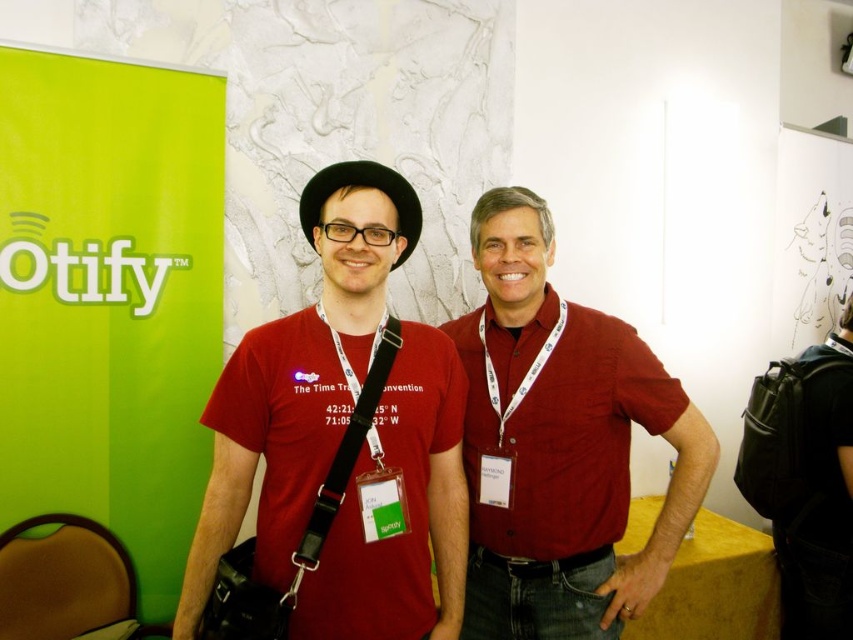
Question: Which object appears farthest from the camera in this image?

Choices:
 (A) white/thick fabric lanyard at center
 (B) matte red shirt at center
 (C) matte red t-shirt at center
 (D) green fabric lanyard at center

Answer: (A)

Question: Can you confirm if matte red t-shirt at center is positioned below matte red shirt at center?

Choices:
 (A) no
 (B) yes

Answer: (A)

Question: Which point is farther to the camera?

Choices:
 (A) matte red t-shirt at center
 (B) white/thick fabric lanyard at center
 (C) matte red shirt at center
 (D) green fabric lanyard at center

Answer: (B)

Question: Can you confirm if matte red t-shirt at center is thinner than green fabric lanyard at center?

Choices:
 (A) yes
 (B) no

Answer: (B)

Question: Is matte red t-shirt at center wider than green fabric lanyard at center?

Choices:
 (A) no
 (B) yes

Answer: (B)

Question: Which point is closer to the camera?

Choices:
 (A) (372, 557)
 (B) (543, 358)
 (C) (592, 564)
 (D) (325, 512)

Answer: (D)